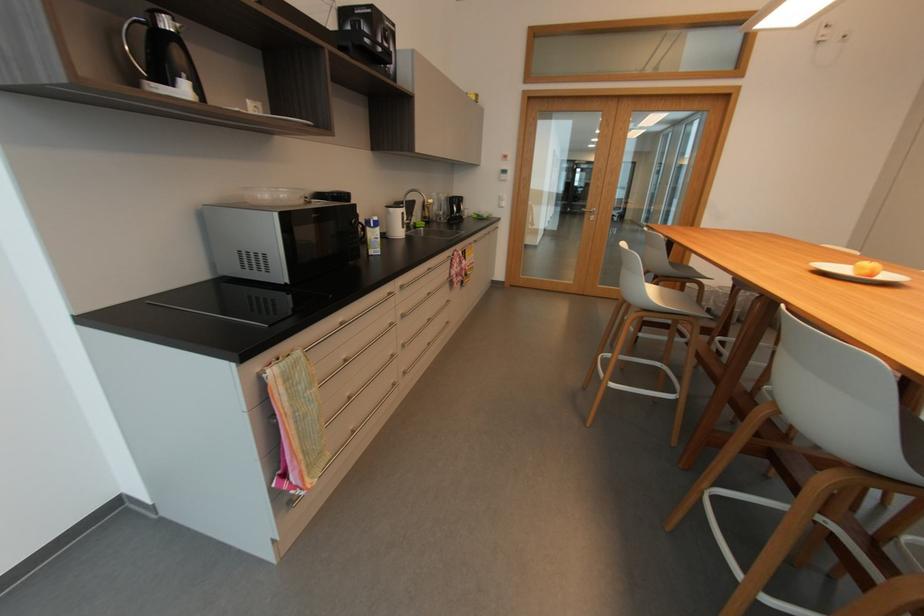
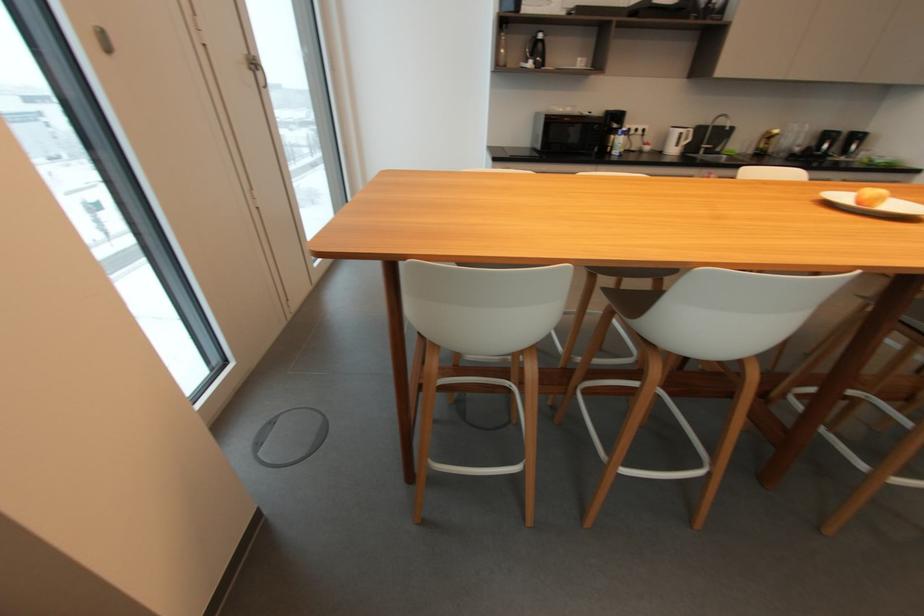
Where in the second image is the point corresponding to [872,264] from the first image?

(881, 191)